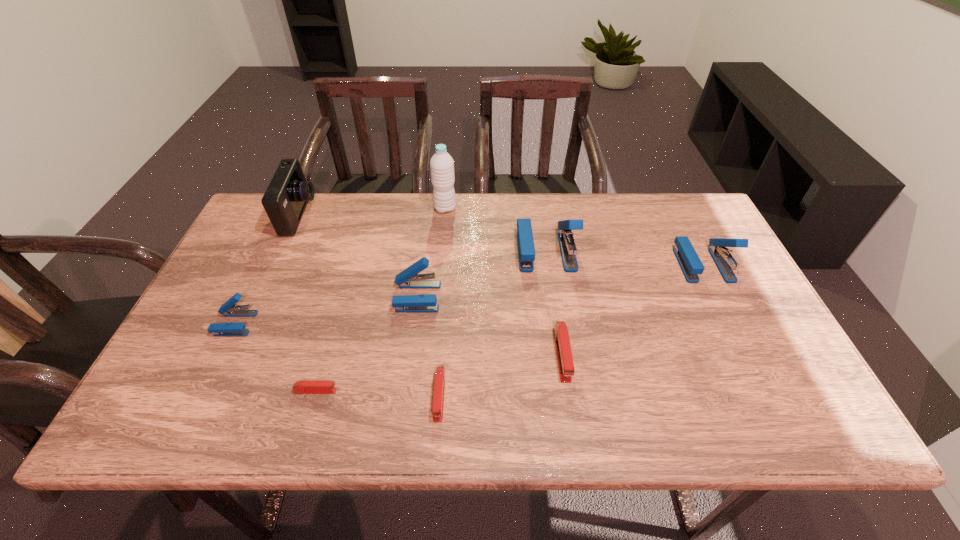
Find the location of `the sixth tallest object`. the sixth tallest object is located at coordinates (228, 309).

Where is `the biggest red stapler`? the biggest red stapler is located at coordinates (562, 342).

Locate an element on the screen. Image resolution: width=960 pixels, height=540 pixels. the third shortest object is located at coordinates (562, 342).

Where is `the second red stapler from left to right`? the second red stapler from left to right is located at coordinates (439, 383).

Identify the location of the second shortest object. (439, 383).

Identify the location of the third object from left to right. (302, 387).

You are a GUI agent. You are given a task and a screenshot of the screen. Output one action in this format:
    pyautogui.click(x=<x>, y=<y>)
    Task: Click on the shortest stapler
    The width and height of the screenshot is (960, 540).
    Given the screenshot: What is the action you would take?
    pyautogui.click(x=302, y=387)

The image size is (960, 540). Identify the location of vacant region located 0.270m on the left of the white water bottle. (350, 208).

At what (x,y) coordinates should I click in order to perform the action: click on free space located on the front-facing side of the camera. Please return your answer as a coordinate pair (x, y). This screenshot has width=960, height=540. Looking at the image, I should click on (360, 216).

Locate an element on the screen. free spot located 0.100m on the right of the tallest stapler is located at coordinates (609, 251).